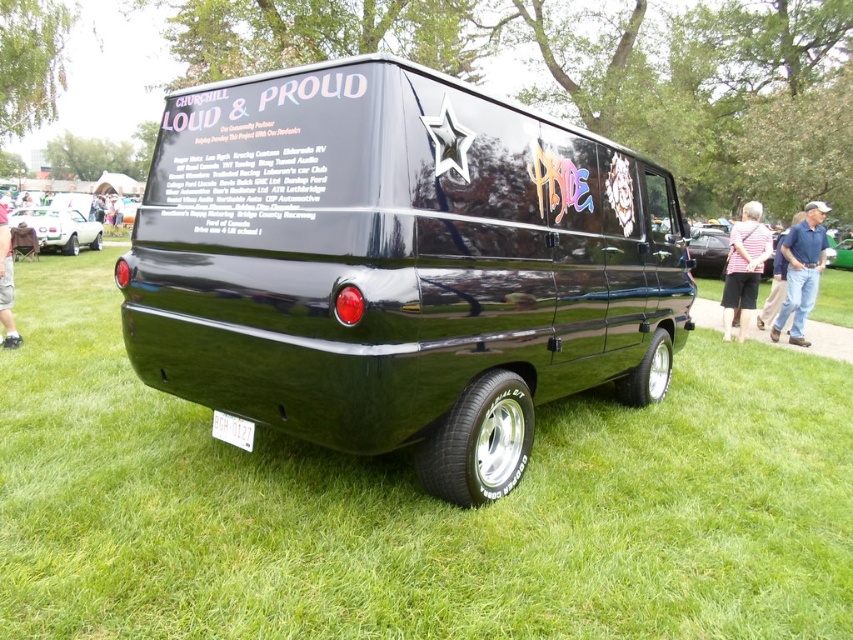
Is green grass at lower center wider than matte white car at left?

Correct, the width of green grass at lower center exceeds that of matte white car at left.

Can you confirm if green grass at lower center is shorter than matte white car at left?

Correct, green grass at lower center is not as tall as matte white car at left.

Describe the element at coordinates (415, 506) in the screenshot. Image resolution: width=853 pixels, height=640 pixels. I see `green grass at lower center` at that location.

This screenshot has height=640, width=853. I want to click on green grass at lower center, so click(x=415, y=506).

Does striped shirt at right have a greater width compared to skinny jeans at lower left?

In fact, striped shirt at right might be narrower than skinny jeans at lower left.

Which is below, striped shirt at right or skinny jeans at lower left?

Positioned lower is skinny jeans at lower left.

Is point (746, 205) positioned after point (12, 298)?

Yes.

At what (x,y) coordinates should I click in order to perform the action: click on striped shirt at right. Please return your answer as a coordinate pair (x, y). Looking at the image, I should click on (744, 268).

Is glossy black van at center thinner than blue jeans at right?

In fact, glossy black van at center might be wider than blue jeans at right.

This screenshot has width=853, height=640. What are the coordinates of `glossy black van at center` in the screenshot? It's located at (398, 266).